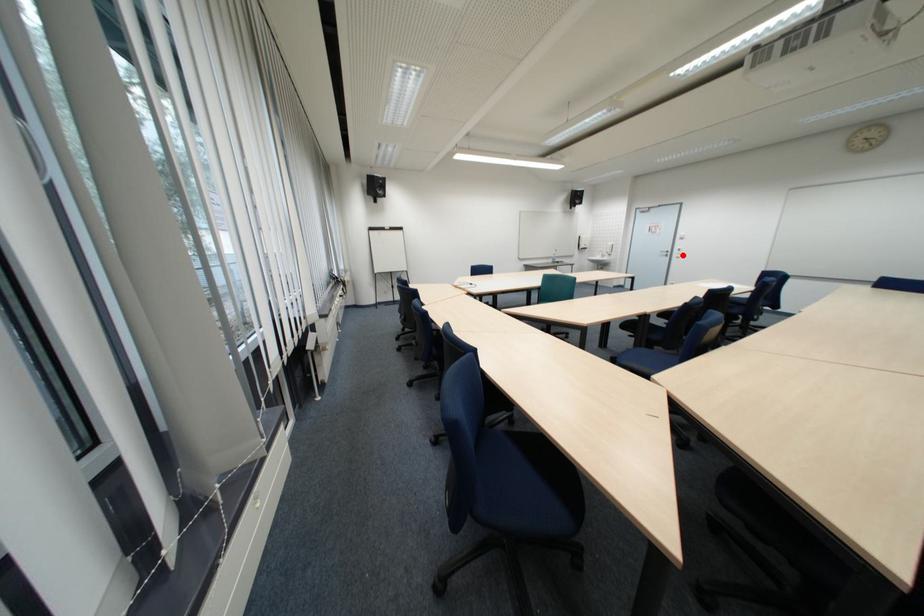
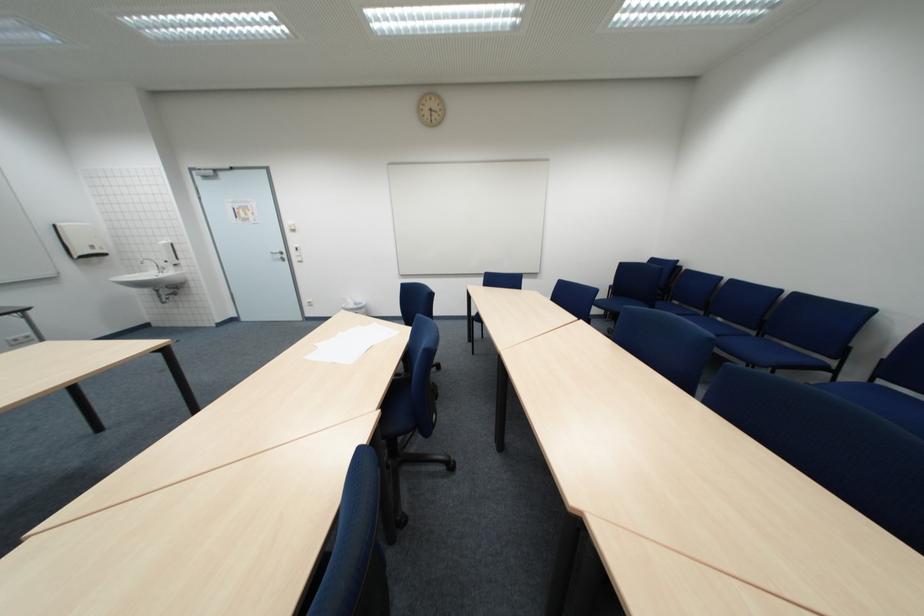
Question: I am providing you with two images of the same scene from different viewpoints. A red point is marked on the first image. At the location where the point appears in image 1, is it still visible in image 2?

Choices:
 (A) Yes
 (B) No

Answer: (A)